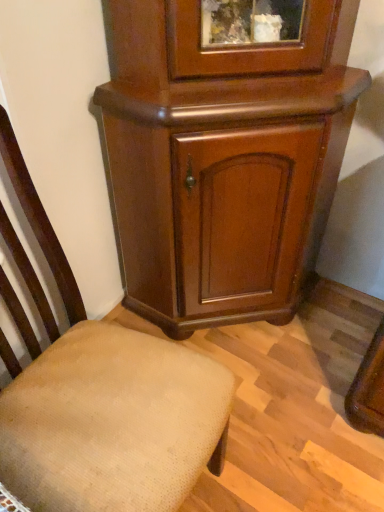
Question: Relative to shiny brown cabinet at center, is beige fabric chair at lower left in front or behind?

Choices:
 (A) front
 (B) behind

Answer: (A)

Question: Is point (213, 446) positioned closer to the camera than point (342, 115)?

Choices:
 (A) farther
 (B) closer

Answer: (B)

Question: Based on their positions, is beige fabric chair at lower left located to the left or right of shiny brown cabinet at center?

Choices:
 (A) right
 (B) left

Answer: (B)

Question: In terms of height, does shiny brown cabinet at center look taller or shorter compared to beige fabric chair at lower left?

Choices:
 (A) tall
 (B) short

Answer: (A)

Question: Based on their positions, is shiny brown cabinet at center located to the left or right of beige fabric chair at lower left?

Choices:
 (A) right
 (B) left

Answer: (A)

Question: Choose the correct answer: Is shiny brown cabinet at center inside beige fabric chair at lower left or outside it?

Choices:
 (A) outside
 (B) inside

Answer: (A)

Question: From a real-world perspective, relative to beige fabric chair at lower left, is shiny brown cabinet at center vertically above or below?

Choices:
 (A) below
 (B) above

Answer: (B)